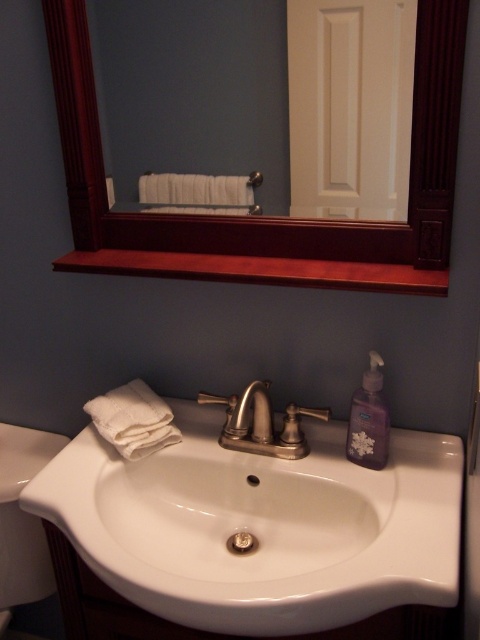
Based on the photo, who is taller, white cotton hand towel at lower left or polished chrome faucet at center?

white cotton hand towel at lower left is taller.

Is white cotton hand towel at lower left bigger than polished chrome faucet at center?

Correct, white cotton hand towel at lower left is larger in size than polished chrome faucet at center.

Locate an element on the screen. white cotton hand towel at lower left is located at coordinates (133, 419).

The image size is (480, 640). In order to click on white cotton hand towel at lower left in this screenshot , I will do `click(133, 419)`.

Looking at this image, is white glossy sink at center wider than translucent plastic soap at sink center?

Indeed, white glossy sink at center has a greater width compared to translucent plastic soap at sink center.

Is white glossy sink at center positioned behind translucent plastic soap at sink center?

No, white glossy sink at center is in front of translucent plastic soap at sink center.

You are a GUI agent. You are given a task and a screenshot of the screen. Output one action in this format:
    pyautogui.click(x=<x>, y=<y>)
    Task: Click on the white glossy sink at center
    Image resolution: width=480 pixels, height=640 pixels.
    Given the screenshot: What is the action you would take?
    pyautogui.click(x=264, y=528)

Does polished chrome faucet at center lie behind translucent plastic soap at sink center?

No.

Is point (254, 419) behind point (230, 536)?

Yes, it is behind point (230, 536).

You are a GUI agent. You are given a task and a screenshot of the screen. Output one action in this format:
    pyautogui.click(x=<x>, y=<y>)
    Task: Click on the polished chrome faucet at center
    The height and width of the screenshot is (640, 480).
    Given the screenshot: What is the action you would take?
    pyautogui.click(x=252, y=413)